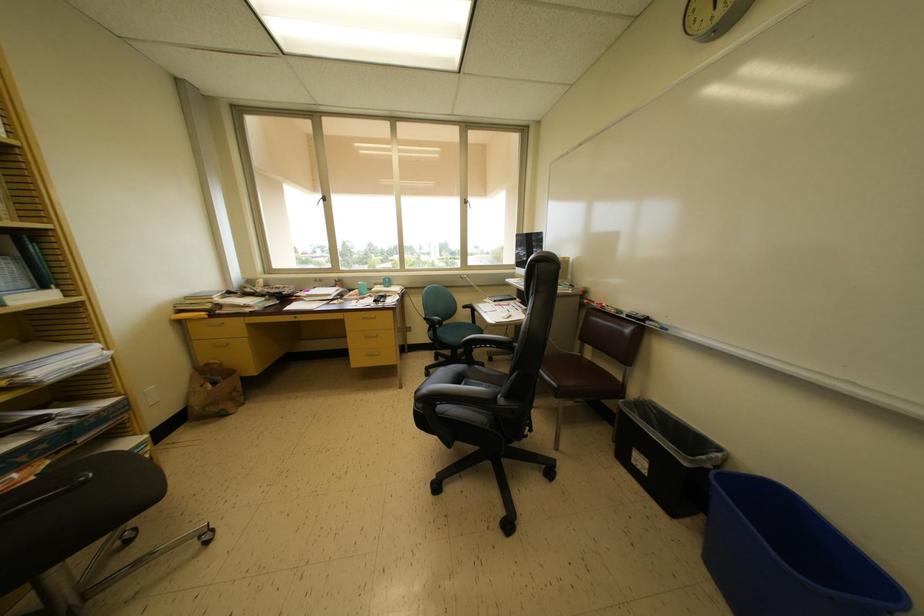
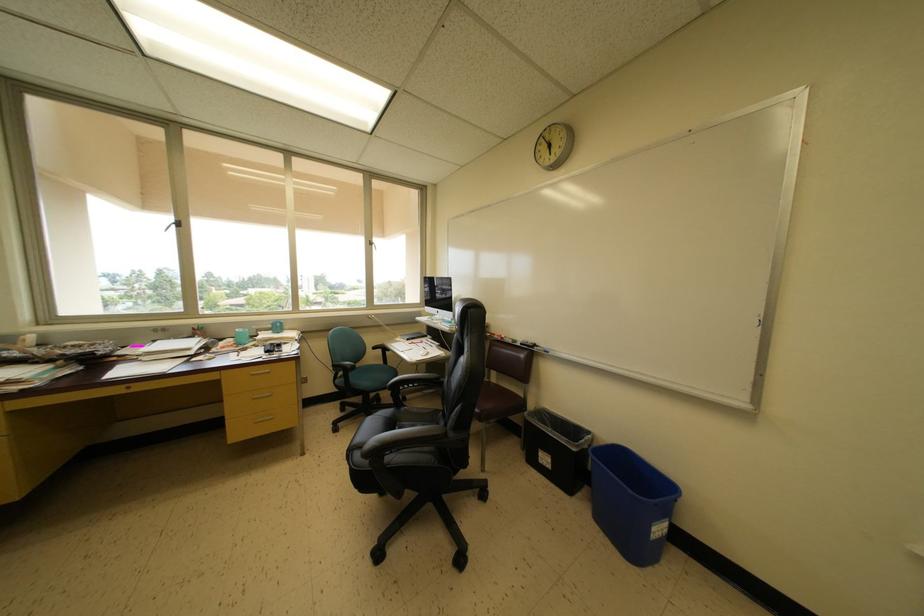
The point at (651, 323) is marked in the first image. Where is the corresponding point in the second image?

(539, 350)